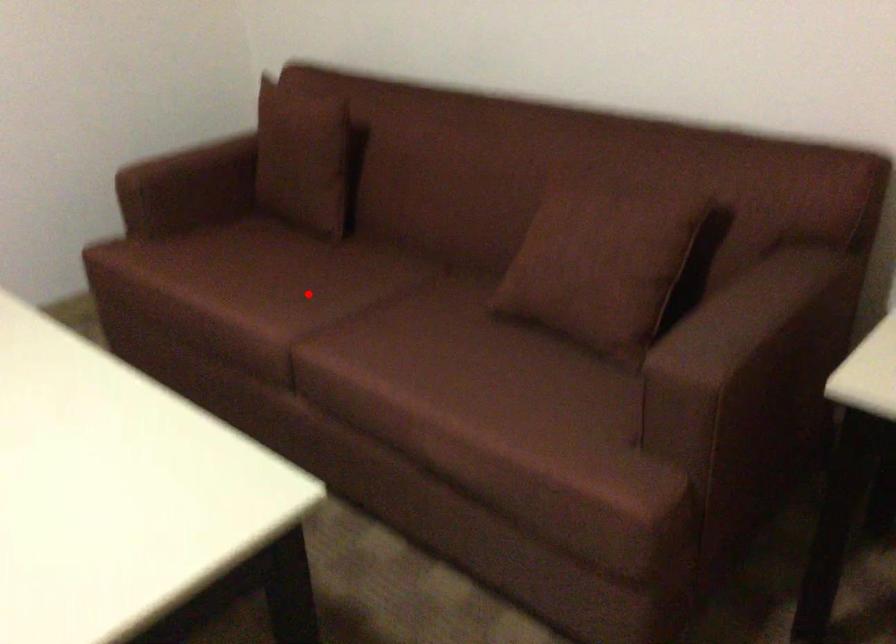
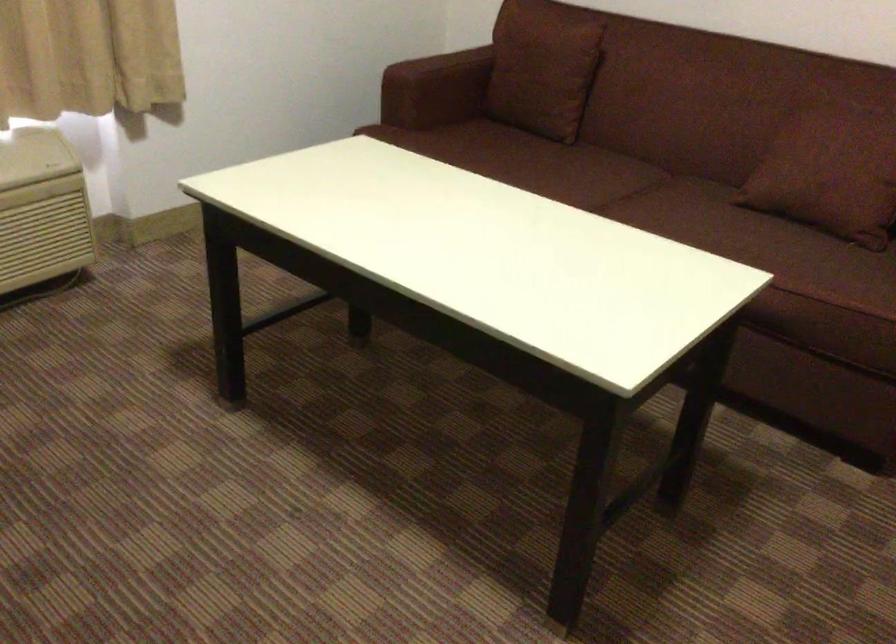
The point at the highlighted location is marked in the first image. Where is the corresponding point in the second image?

(574, 176)